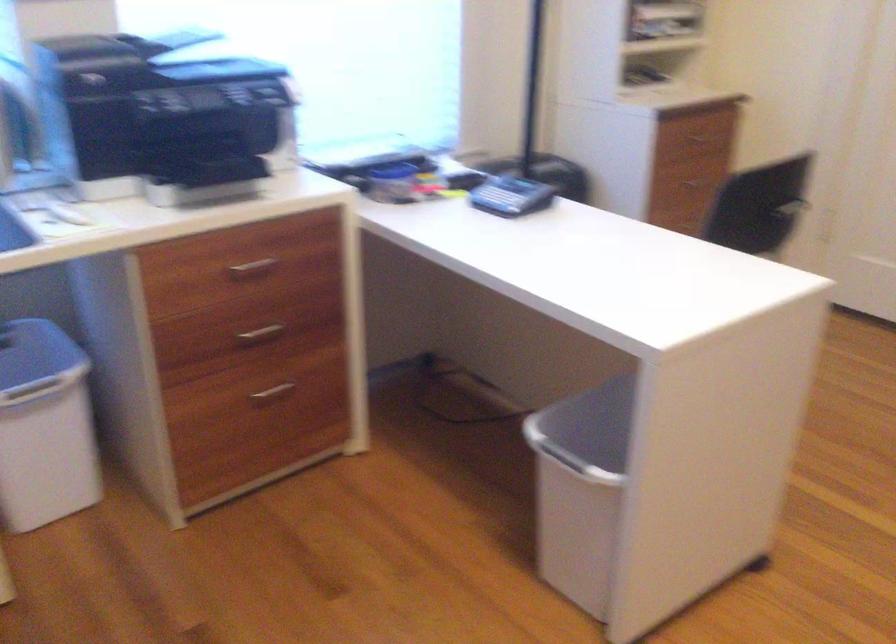
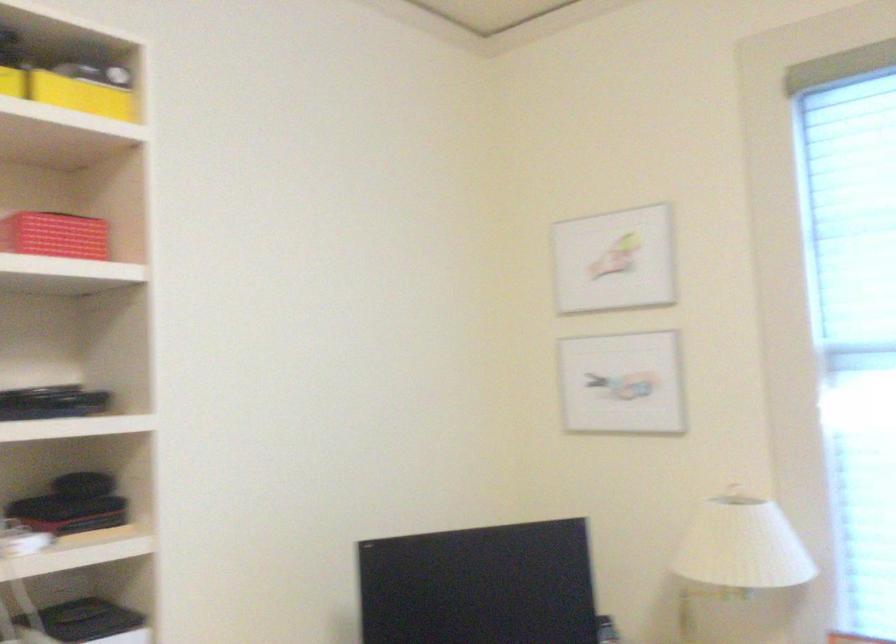
Question: The images are taken continuously from a first-person perspective. In which direction is your viewpoint rotating?

Choices:
 (A) Left
 (B) Right
 (C) Up
 (D) Down

Answer: (A)